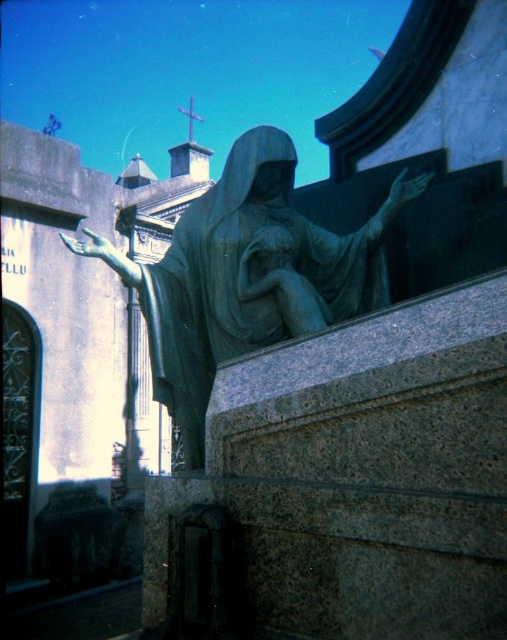
Is green patina statue at center positioned at the back of bronze statue at center?

No, green patina statue at center is in front of bronze statue at center.

Is green patina statue at center bigger than bronze statue at center?

Indeed, green patina statue at center has a larger size compared to bronze statue at center.

Locate an element on the screen. Image resolution: width=507 pixels, height=640 pixels. green patina statue at center is located at coordinates coord(247,275).